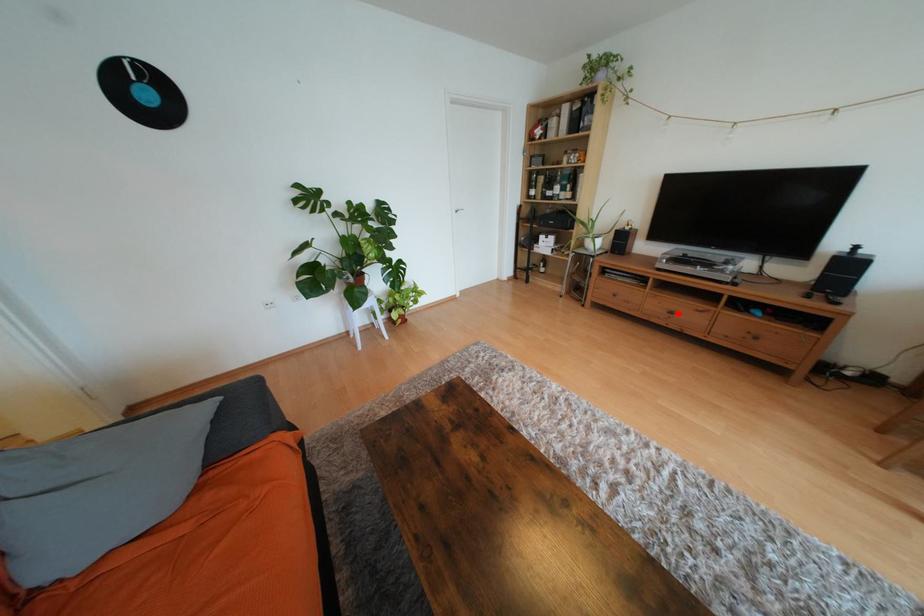
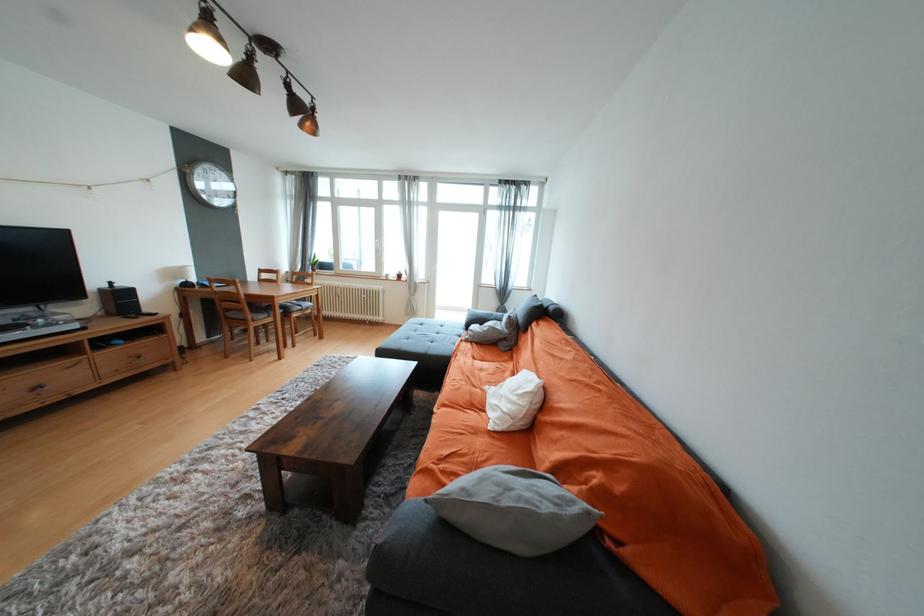
Question: I am providing you with two images of the same scene from different viewpoints. A red point is marked on the first image. Is the red point's position out of view in image 2?

Choices:
 (A) Yes
 (B) No

Answer: (B)